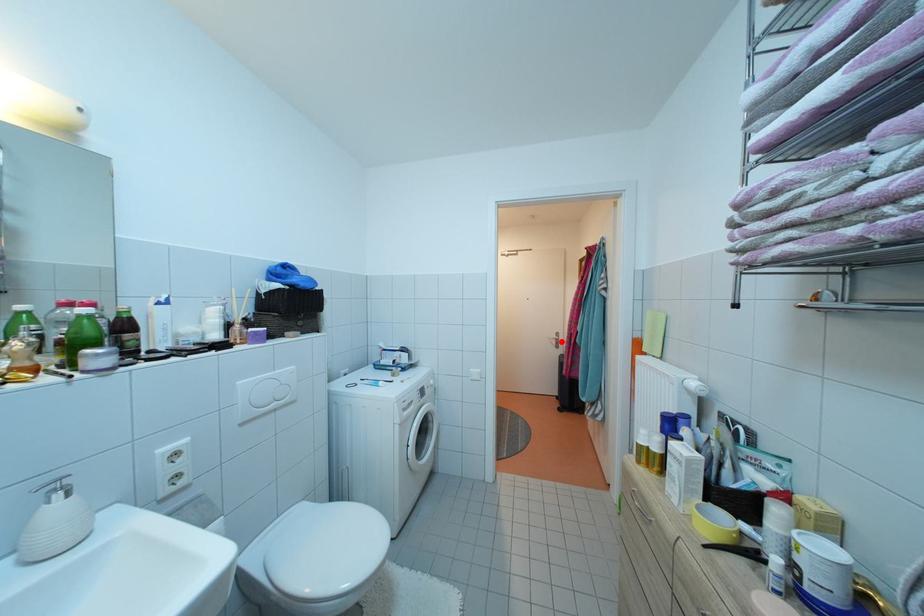
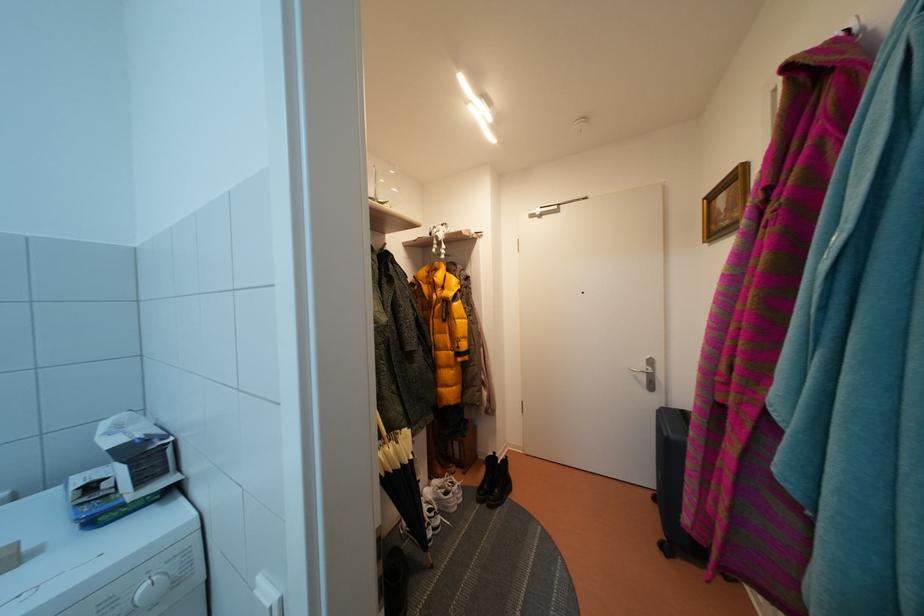
Locate, in the second image, the point that corresponds to the highlighted location in the first image.

(650, 371)